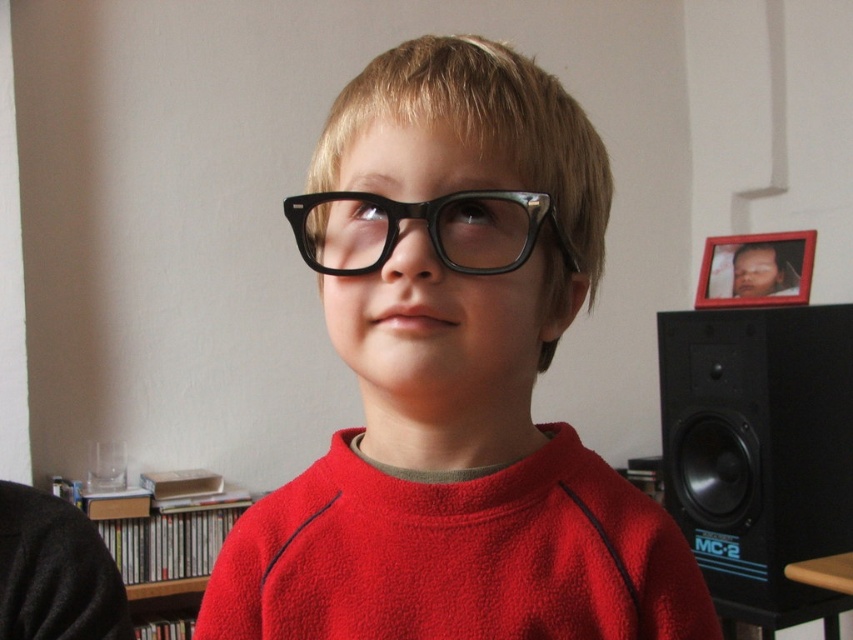
You are a photographer adjusting your camera to focus on the matte black glasses at center and the black plastic speaker at right. Which object should you adjust the focus for first if you want to capture both in sharp detail?

The matte black glasses at center is closer to the viewer than the black plastic speaker at right, so you should focus on the matte black glasses at center first to ensure both are in sharp detail.

Consider the image. You are a photographer setting up a shot of the child. The black plastic speaker at right and wooden bookshelf at lower left are in the background. To avoid them being in the shot, should you move the camera up or down?

The black plastic speaker at right is above the wooden bookshelf at lower left. To avoid both, move the camera down so the speaker is out of frame while keeping the bookshelf hidden as well.